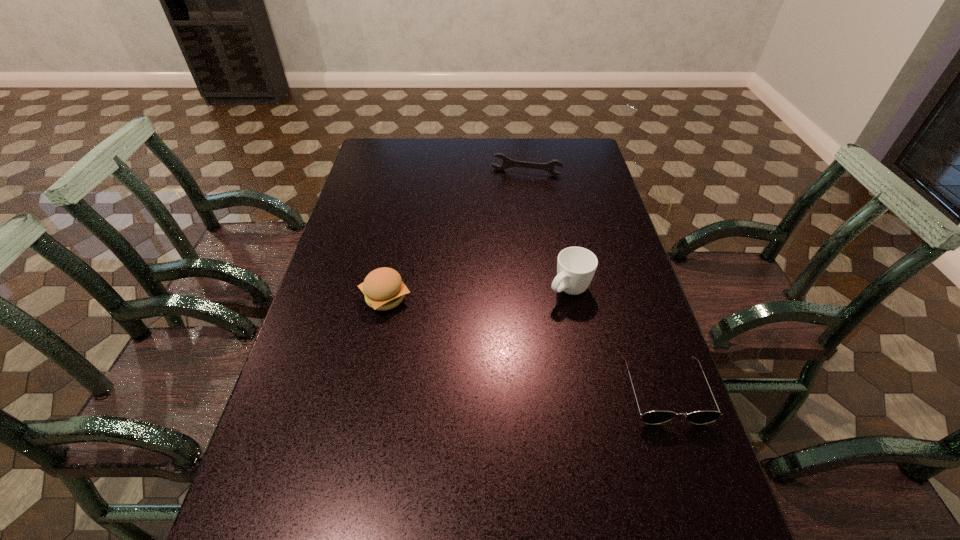
Where is `free space on the desktop that is between the hamburger and the sunglasses and is positioned on the open ends of the farthest object`? free space on the desktop that is between the hamburger and the sunglasses and is positioned on the open ends of the farthest object is located at coordinates (487, 332).

Where is `vacant spot on the desktop that is between the third shortest object and the nearest object and is positioned with the handle on the side of the cup`? The height and width of the screenshot is (540, 960). vacant spot on the desktop that is between the third shortest object and the nearest object and is positioned with the handle on the side of the cup is located at coordinates (512, 340).